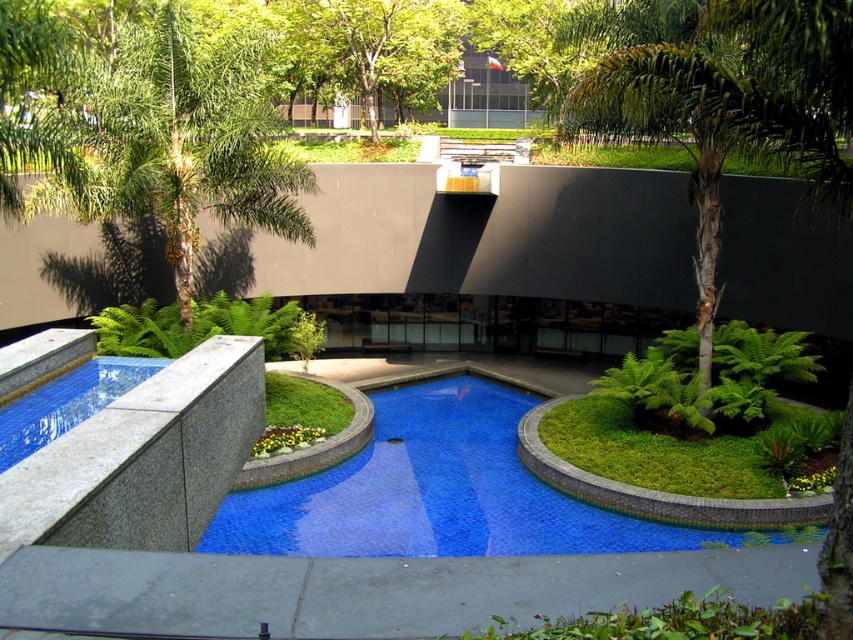
You are a landscape architect evaluating the space. You need to place a new bench that requires a minimum of 3 square meters of flat space. The bench must be placed near the green leafy tree at center or the smooth concrete edge at lower left. Which location would you choose and why?

You should place the bench near the smooth concrete edge at lower left because the green leafy tree at center is bigger than the smooth concrete edge at lower left, implying the tree area may not have enough flat space for the bench.

Based on the scene description, which tree is taller between the green leafy palm tree at left and the green leafy tree at upper center?

The green leafy tree at upper center is taller than the green leafy palm tree at left.

You are standing in front of the modern architectural design and want to locate the blue glossy pool at center. What are the coordinates of its position?

The blue glossy pool at center is located at coordinates (x=434, y=492).